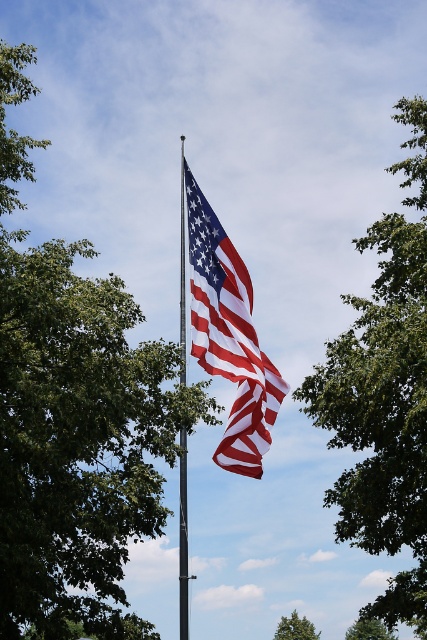
Does green leafy tree at upper center have a larger size compared to green leafy tree at center?

Indeed, green leafy tree at upper center has a larger size compared to green leafy tree at center.

Where is `green leafy tree at upper center`? This screenshot has height=640, width=427. green leafy tree at upper center is located at coordinates (382, 416).

Is green leafy tree at upper left to the left of green leafy tree at center from the viewer's perspective?

Correct, you'll find green leafy tree at upper left to the left of green leafy tree at center.

Where is `green leafy tree at upper left`? green leafy tree at upper left is located at coordinates (78, 442).

Is point (152, 636) positioned after point (362, 636)?

No, (152, 636) is closer to viewer.

The width and height of the screenshot is (427, 640). I want to click on green leafy tree at upper left, so click(x=78, y=442).

Which of these two, green leafy tree at upper left or green leafy tree at lower center, stands taller?

green leafy tree at upper left

Can you confirm if green leafy tree at upper left is positioned to the left of green leafy tree at lower center?

Correct, you'll find green leafy tree at upper left to the left of green leafy tree at lower center.

Measure the distance between point [35,440] and camera.

22.59 meters

You are a GUI agent. You are given a task and a screenshot of the screen. Output one action in this format:
    pyautogui.click(x=<x>, y=<y>)
    Task: Click on the green leafy tree at upper left
    The height and width of the screenshot is (640, 427).
    Given the screenshot: What is the action you would take?
    pyautogui.click(x=78, y=442)